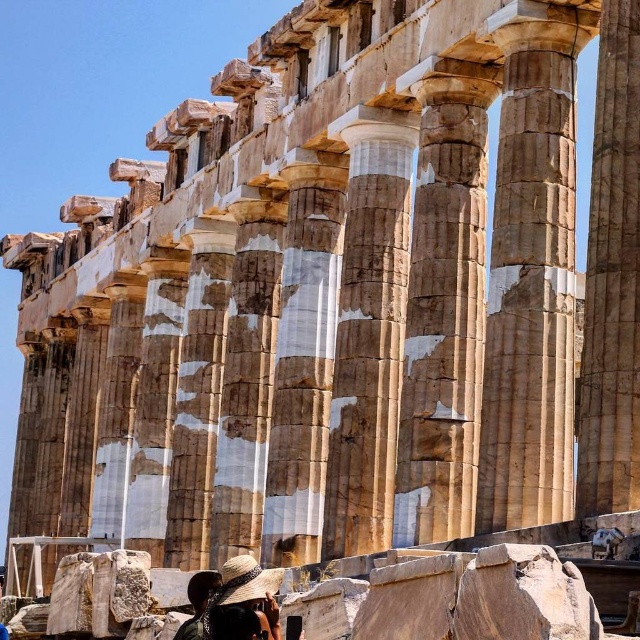
Question: Does matte straw hat at lower center appear over dark brown hair at lower center?

Choices:
 (A) yes
 (B) no

Answer: (A)

Question: Can you confirm if matte straw hat at lower center is smaller than dark brown hair at lower center?

Choices:
 (A) yes
 (B) no

Answer: (B)

Question: Which object is farther from the camera taking this photo?

Choices:
 (A) dark brown hair at lower center
 (B) matte straw hat at lower center

Answer: (A)

Question: Is matte straw hat at lower center bigger than dark brown hair at lower center?

Choices:
 (A) yes
 (B) no

Answer: (A)

Question: Which point appears closest to the camera in this image?

Choices:
 (A) (241, 572)
 (B) (205, 604)

Answer: (A)